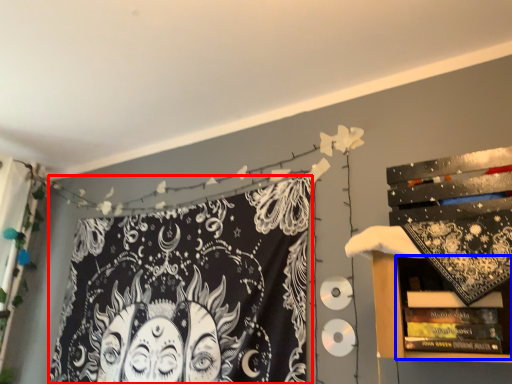
Question: Which point is further to the camera, fabric (highlighted by a red box) or shelf (highlighted by a blue box)?

Choices:
 (A) fabric
 (B) shelf

Answer: (A)